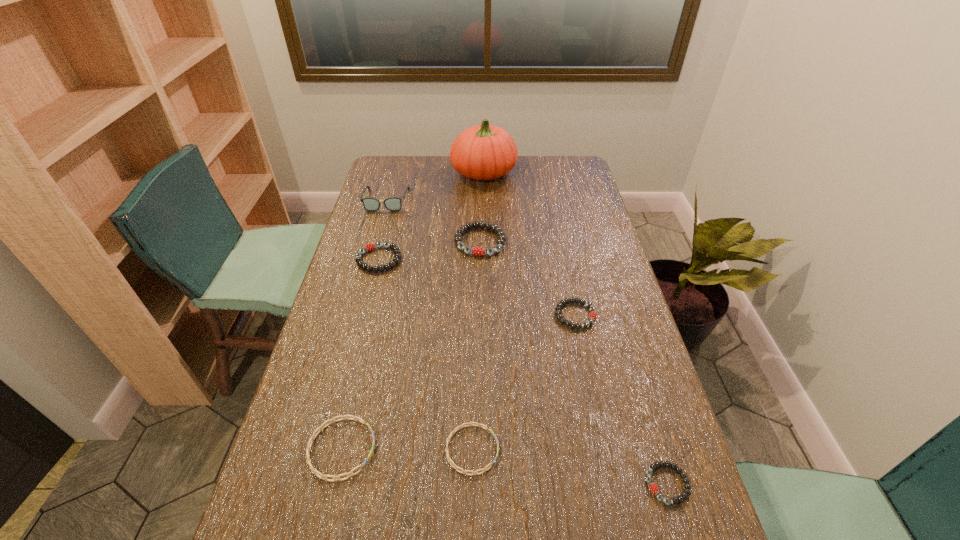
You are a GUI agent. You are given a task and a screenshot of the screen. Output one action in this format:
    pyautogui.click(x=<x>, y=<y>)
    Task: Click on the closest blue bracelet relative to the biggest black bracelet
    This screenshot has width=960, height=540.
    Given the screenshot: What is the action you would take?
    pyautogui.click(x=471, y=423)

You are a GUI agent. You are given a task and a screenshot of the screen. Output one action in this format:
    pyautogui.click(x=<x>, y=<y>)
    Task: Click on the vacant space that satisfies the following two spatial constraints: 1. on the face of the second black bracelet from right to left; 2. on the right side of the gray spectacles
    The width and height of the screenshot is (960, 540).
    Given the screenshot: What is the action you would take?
    pyautogui.click(x=354, y=315)

Image resolution: width=960 pixels, height=540 pixels. I want to click on free space that satisfies the following two spatial constraints: 1. on the front side of the third black bracelet from right to left; 2. on the surface of the left blue bracelet showing star-shaped elements, so click(480, 449).

The image size is (960, 540). Identify the location of free location that satisfies the following two spatial constraints: 1. on the back side of the leftmost black bracelet; 2. on the right side of the second black bracelet from left to right. (383, 241).